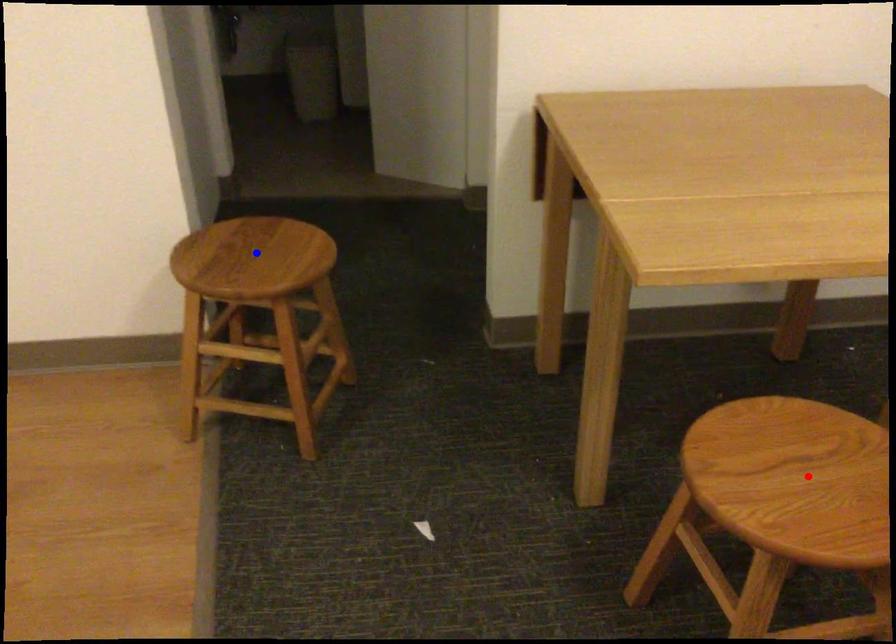
Question: Which of the two points in the image is closer to the camera?

Choices:
 (A) Blue point is closer.
 (B) Red point is closer.

Answer: (B)